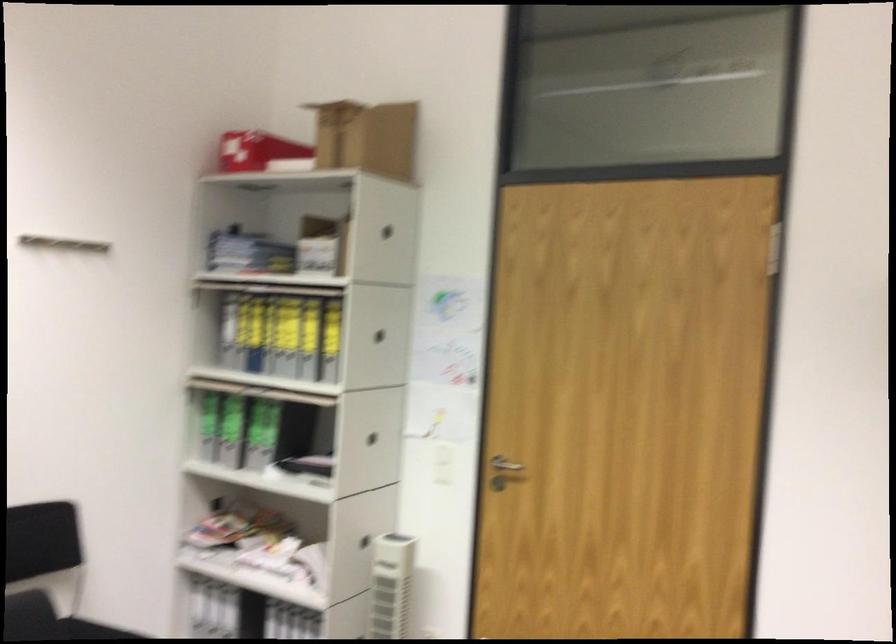
Image resolution: width=896 pixels, height=644 pixels. Describe the element at coordinates (48, 621) in the screenshot. I see `the chair sitting surface` at that location.